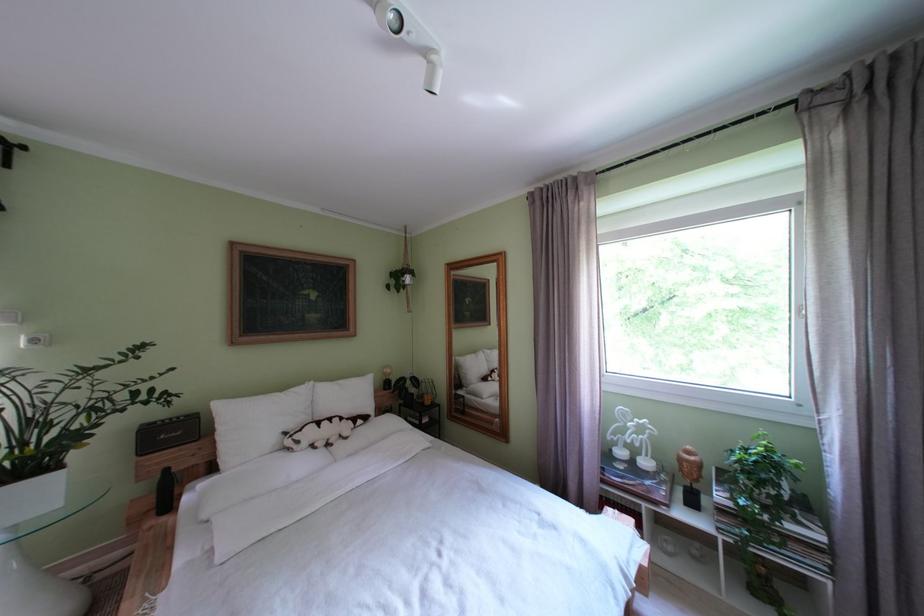
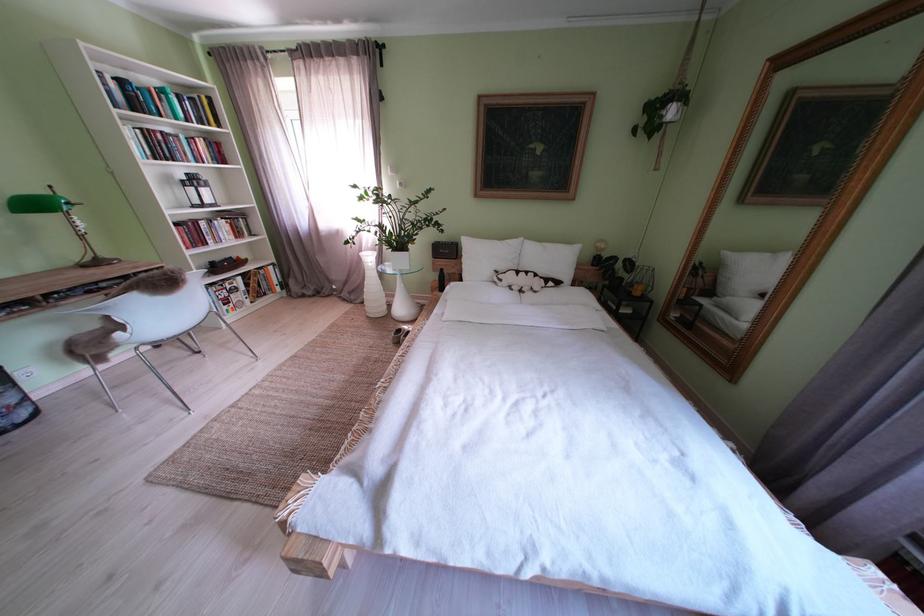
Locate, in the second image, the point that corresponds to [439,408] in the first image.

(648, 299)